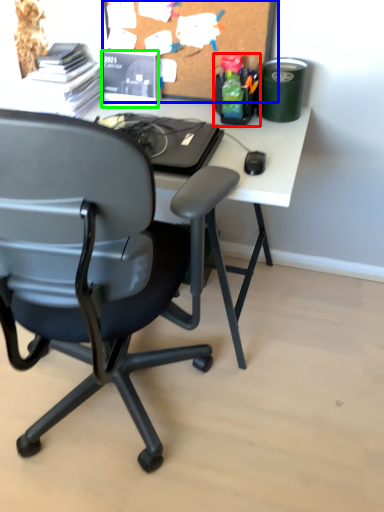
Question: Which is farther away from stationery (highlighted by a red box)? bulletin board (highlighted by a blue box) or stationery (highlighted by a green box)?

Choices:
 (A) bulletin board
 (B) stationery

Answer: (B)